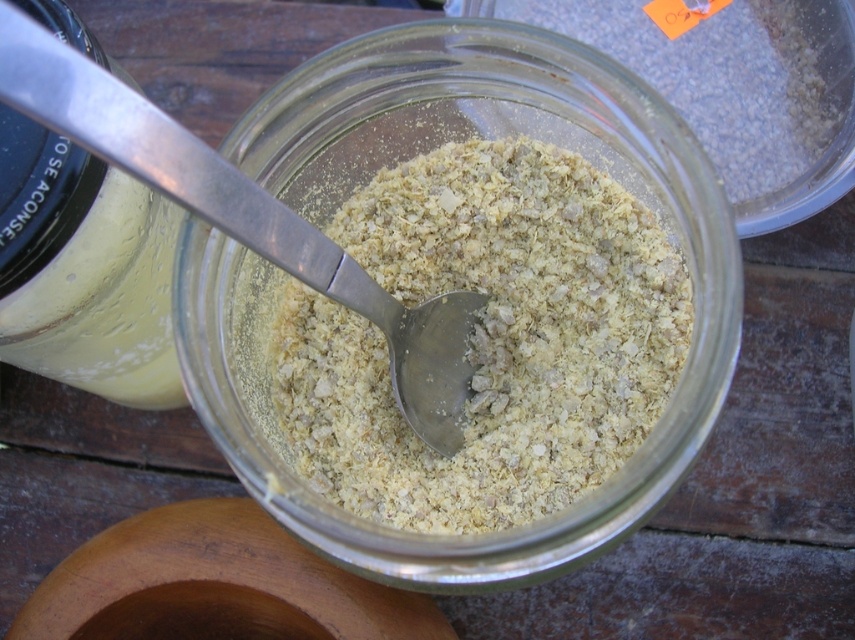
Can you confirm if white crumbly substance at center is wider than silver metallic spoon at center?

Indeed, white crumbly substance at center has a greater width compared to silver metallic spoon at center.

Locate an element on the screen. white crumbly substance at center is located at coordinates (487, 337).

Who is more forward, (650,388) or (38,96)?

Point (38,96) is more forward.

The width and height of the screenshot is (855, 640). In order to click on white crumbly substance at center in this screenshot , I will do `click(487, 337)`.